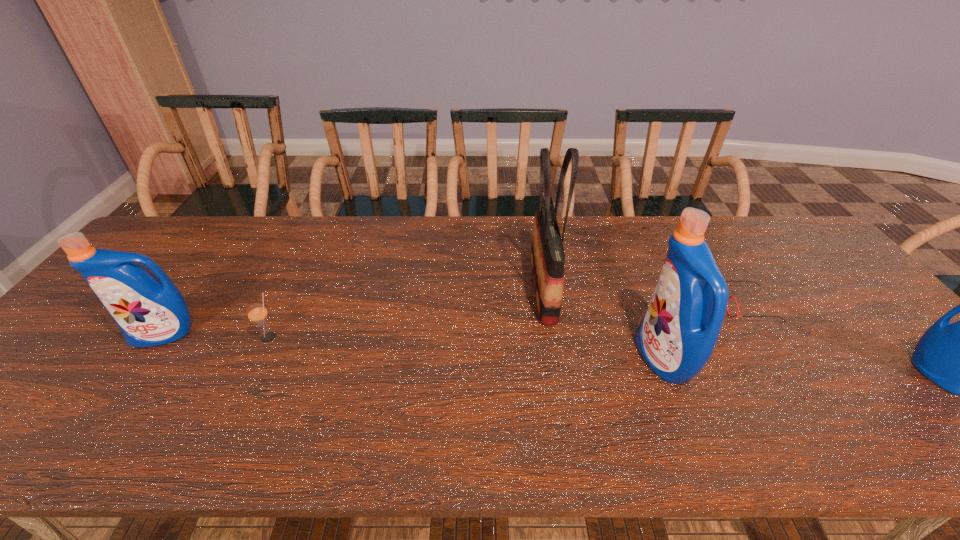
At what (x,y) coordinates should I click in order to perform the action: click on the leftmost object. Please return your answer as a coordinate pair (x, y). The width and height of the screenshot is (960, 540). Looking at the image, I should click on (150, 311).

Find the location of a particular element. The image size is (960, 540). the second tallest detergent is located at coordinates [x=150, y=311].

The image size is (960, 540). In order to click on the tallest detergent in this screenshot , I will do `click(678, 333)`.

This screenshot has height=540, width=960. In order to click on the third object from right to left in this screenshot , I will do `click(678, 333)`.

Locate an element on the screen. The image size is (960, 540). the fifth object from left to right is located at coordinates point(726,281).

Locate an element on the screen. This screenshot has width=960, height=540. the shortest object is located at coordinates coord(726,281).

The width and height of the screenshot is (960, 540). In order to click on shopping bag in this screenshot , I will do `click(547, 253)`.

Where is `the fifth object from right to left`? the fifth object from right to left is located at coordinates (257, 313).

Identify the location of straw. This screenshot has width=960, height=540. (257, 313).

Locate an element on the screen. This screenshot has width=960, height=540. vacant position located 0.070m on the label of the leftmost detergent is located at coordinates (138, 372).